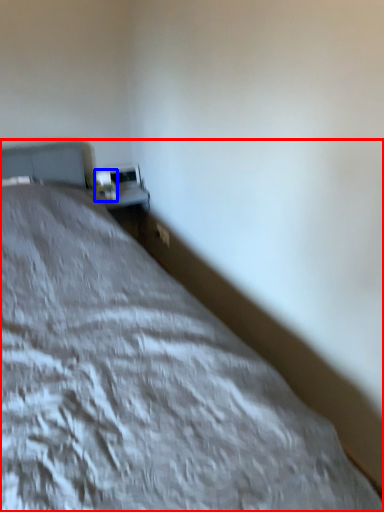
Question: Which of the following is the farthest to the observer, bed (highlighted by a red box) or table lamp (highlighted by a blue box)?

Choices:
 (A) bed
 (B) table lamp

Answer: (B)